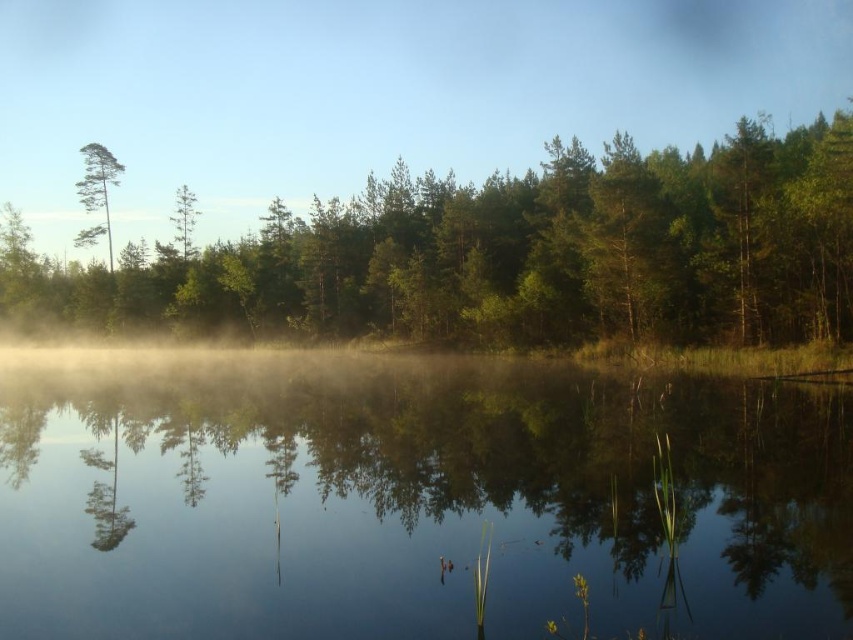
Question: Can you confirm if green matte tree at upper center is thinner than green matte tree at left?

Choices:
 (A) no
 (B) yes

Answer: (A)

Question: Estimate the real-world distances between objects in this image. Which object is farther from the green matte tree at upper center?

Choices:
 (A) green matte tree at left
 (B) transparent water at center

Answer: (A)

Question: Which object appears farthest from the camera in this image?

Choices:
 (A) transparent water at center
 (B) green matte tree at upper center

Answer: (B)

Question: Does green matte tree at upper center appear on the right side of green matte tree at left?

Choices:
 (A) no
 (B) yes

Answer: (B)

Question: Which object appears farthest from the camera in this image?

Choices:
 (A) green matte tree at upper center
 (B) transparent water at center
 (C) green matte tree at left

Answer: (C)

Question: Is green matte tree at upper center above green matte tree at left?

Choices:
 (A) yes
 (B) no

Answer: (A)